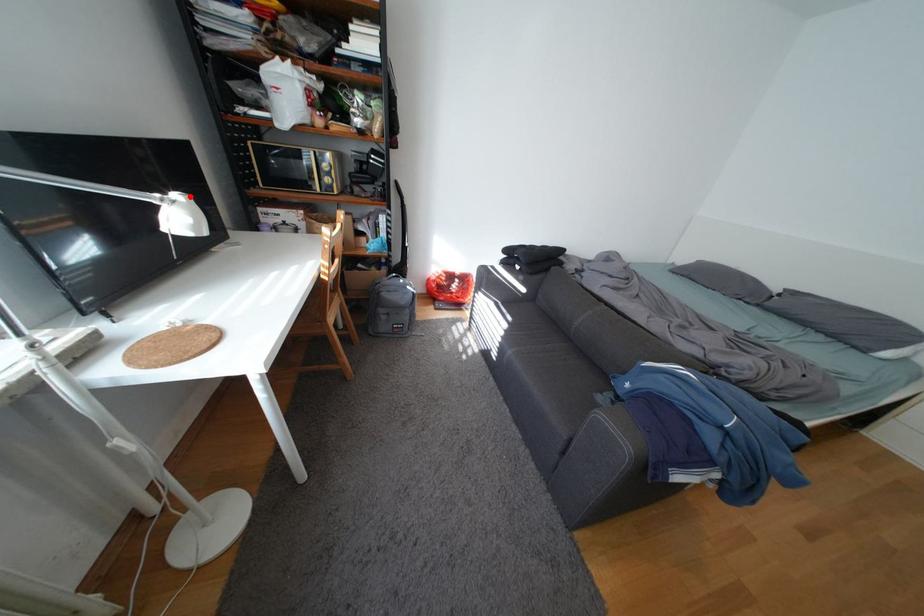
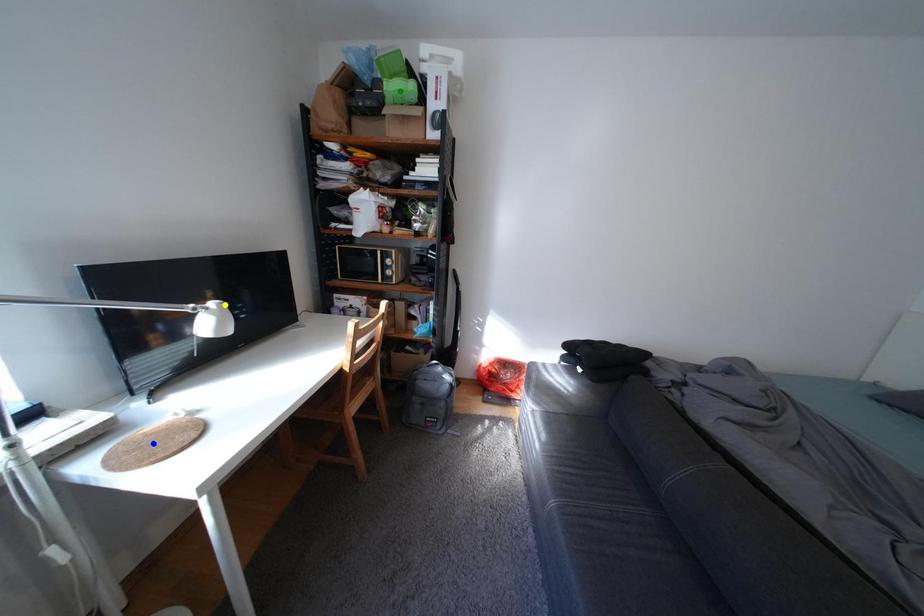
Question: I am providing you with two images of the same scene from different viewpoints. A red point is marked on the first image. You are given multiple points on the second image. Which spot in image 2 lines up with the point in image 1?

Choices:
 (A) yellow point
 (B) green point
 (C) blue point

Answer: (A)